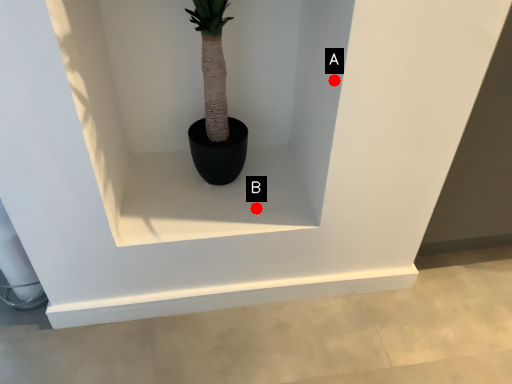
Question: Two points are circled on the image, labeled by A and B beside each circle. Which point appears closest to the camera in this image?

Choices:
 (A) A is closer
 (B) B is closer

Answer: (A)